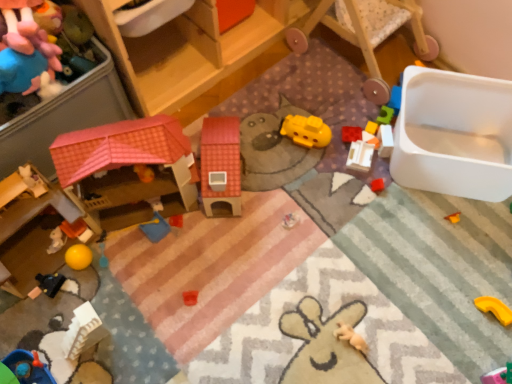
At what (x,y) coordinates should I click in order to perform the action: click on free space to the back side of black matte toy car at lower left, arranged as the 2th toy when viewed from the left. Please return your answer as a coordinate pair (x, y). Looking at the image, I should click on (53, 238).